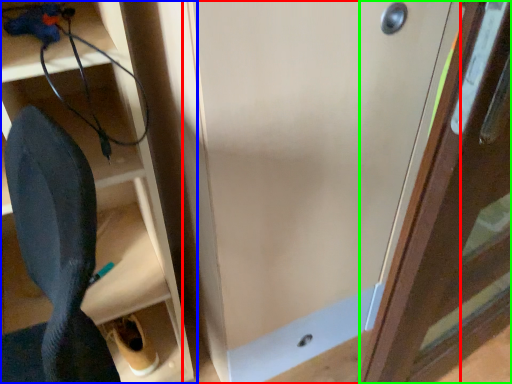
Question: Which object is the closest to the door (highlighted by a red box)? Choose among these: shelf (highlighted by a blue box) or door (highlighted by a green box).

Choices:
 (A) shelf
 (B) door

Answer: (B)